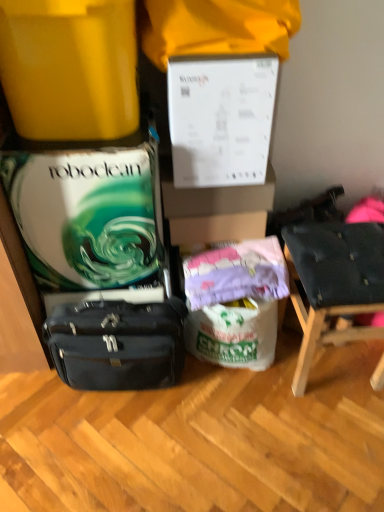
At what (x,y) coordinates should I click in order to perform the action: click on purple fabric at center. Please return your answer as a coordinate pair (x, y). Looking at the image, I should click on click(x=236, y=273).

Measure the distance between point (57,351) and camera.

4.32 feet.

What do you see at coordinates (117, 344) in the screenshot?
I see `matte black briefcase at lower left` at bounding box center [117, 344].

Identify the location of dark blue fabric chair at right. The height and width of the screenshot is (512, 384). (333, 283).

Considering the sizes of objects dark blue fabric chair at right and matte black briefcase at lower left in the image provided, who is bigger, dark blue fabric chair at right or matte black briefcase at lower left?

dark blue fabric chair at right is bigger.

What's the angular difference between dark blue fabric chair at right and matte black briefcase at lower left's facing directions?

The angle between the facing direction of dark blue fabric chair at right and the facing direction of matte black briefcase at lower left is 3.85 degrees.

Locate an element on the screen. The width and height of the screenshot is (384, 512). luggage and bags on the left of dark blue fabric chair at right is located at coordinates (117, 344).

Is point (320, 335) closer to viewer compared to point (161, 336)?

No.

Considering the sizes of objects purple fabric at center and matte yellow container at upper left in the image provided, who is thinner, purple fabric at center or matte yellow container at upper left?

purple fabric at center is thinner.

Does purple fabric at center contain matte yellow container at upper left?

Actually, matte yellow container at upper left is outside purple fabric at center.

From a real-world perspective, which is physically below, purple fabric at center or matte yellow container at upper left?

purple fabric at center is physically lower.

From the image's perspective, is purple fabric at center under matte yellow container at upper left?

Yes, from the image's perspective, purple fabric at center is below matte yellow container at upper left.

From a real-world perspective, who is located higher, matte black briefcase at lower left or matte yellow container at upper left?

matte yellow container at upper left.

Does matte black briefcase at lower left come in front of matte yellow container at upper left?

No, it is behind matte yellow container at upper left.

I want to click on box that is in front of the matte black briefcase at lower left, so (70, 68).

Is matte black briefcase at lower left in contact with matte yellow container at upper left?

They are not placed beside each other.

From the image's perspective, would you say dark blue fabric chair at right is positioned over matte yellow container at upper left?

Actually, dark blue fabric chair at right appears below matte yellow container at upper left in the image.

Who is smaller, dark blue fabric chair at right or matte yellow container at upper left?

matte yellow container at upper left.

Which object is closer to the camera taking this photo, dark blue fabric chair at right or matte yellow container at upper left?

matte yellow container at upper left is in front.

In the scene shown: From a real-world perspective, is dark blue fabric chair at right on matte yellow container at upper left?

No.

Is matte yellow container at upper left oriented away from dark blue fabric chair at right?

No, matte yellow container at upper left is not facing the opposite direction of dark blue fabric chair at right.

Which object is closer to the camera taking this photo, matte yellow container at upper left or dark blue fabric chair at right?

matte yellow container at upper left is closer to the camera.

Locate an element on the screen. box located on the left of dark blue fabric chair at right is located at coordinates (70, 68).

Can you tell me how much matte yellow container at upper left and dark blue fabric chair at right differ in facing direction?

matte yellow container at upper left and dark blue fabric chair at right are facing 2.36 degrees away from each other.

Is purple fabric at center taller than dark blue fabric chair at right?

No, purple fabric at center is not taller than dark blue fabric chair at right.

Does point (278, 288) appear closer or farther from the camera than point (302, 306)?

Point (278, 288).

Is purple fabric at center further to camera compared to dark blue fabric chair at right?

That is True.

In terms of width, does matte yellow container at upper left look wider or thinner when compared to matte black briefcase at lower left?

Considering their sizes, matte yellow container at upper left looks broader than matte black briefcase at lower left.

Which is less distant, (x=60, y=26) or (x=60, y=332)?

The point (x=60, y=26) is more forward.

Considering the sizes of objects matte yellow container at upper left and matte black briefcase at lower left in the image provided, who is smaller, matte yellow container at upper left or matte black briefcase at lower left?

Smaller between the two is matte black briefcase at lower left.

This screenshot has height=512, width=384. Identify the location of luggage and bags beneath the dark blue fabric chair at right (from a real-world perspective). (117, 344).

The width and height of the screenshot is (384, 512). In order to click on material behind the matte yellow container at upper left in this screenshot , I will do `click(236, 273)`.

When comparing their distances from matte yellow container at upper left, does purple fabric at center or dark blue fabric chair at right seem further?

Based on the image, dark blue fabric chair at right appears to be further to matte yellow container at upper left.

From the image, which object appears to be nearer to purple fabric at center, matte black briefcase at lower left or matte yellow container at upper left?

Among the two, matte black briefcase at lower left is located nearer to purple fabric at center.

When comparing their distances from matte yellow container at upper left, does purple fabric at center or matte black briefcase at lower left seem further?

matte black briefcase at lower left is positioned further to the anchor matte yellow container at upper left.

When comparing their distances from matte yellow container at upper left, does dark blue fabric chair at right or matte black briefcase at lower left seem further?

Among the two, dark blue fabric chair at right is located further to matte yellow container at upper left.

Estimate the real-world distances between objects in this image. Which object is further from purple fabric at center, matte black briefcase at lower left or dark blue fabric chair at right?

The object further to purple fabric at center is matte black briefcase at lower left.

Based on their spatial positions, is dark blue fabric chair at right or purple fabric at center closer to matte yellow container at upper left?

purple fabric at center is closer to matte yellow container at upper left.

When comparing their distances from matte yellow container at upper left, does matte black briefcase at lower left or purple fabric at center seem further?

matte black briefcase at lower left is positioned further to the anchor matte yellow container at upper left.

From the image, which object appears to be farther from dark blue fabric chair at right, matte yellow container at upper left or purple fabric at center?

matte yellow container at upper left is positioned further to the anchor dark blue fabric chair at right.

Image resolution: width=384 pixels, height=512 pixels. Find the location of `chair between matte yellow container at upper left and matte black briefcase at lower left in the up-down direction`. chair between matte yellow container at upper left and matte black briefcase at lower left in the up-down direction is located at coordinates (333, 283).

Identify the location of material located between matte black briefcase at lower left and dark blue fabric chair at right in the left-right direction. (236, 273).

The width and height of the screenshot is (384, 512). In order to click on material between matte yellow container at upper left and matte black briefcase at lower left vertically in this screenshot , I will do `click(236, 273)`.

Identify the location of material between matte yellow container at upper left and dark blue fabric chair at right. (236, 273).